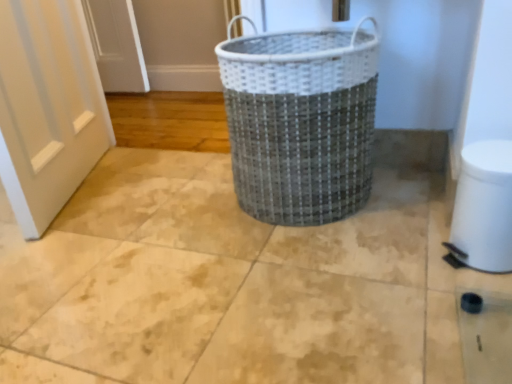
Question: Does metallic woven basket at center come in front of white plastic toilet bowl at lower right?

Choices:
 (A) no
 (B) yes

Answer: (A)

Question: Does metallic woven basket at center contain white plastic toilet bowl at lower right?

Choices:
 (A) yes
 (B) no

Answer: (B)

Question: Does metallic woven basket at center have a smaller size compared to white plastic toilet bowl at lower right?

Choices:
 (A) no
 (B) yes

Answer: (A)

Question: From the image's perspective, is metallic woven basket at center located above white plastic toilet bowl at lower right?

Choices:
 (A) yes
 (B) no

Answer: (A)

Question: Is metallic woven basket at center further to the viewer compared to white plastic toilet bowl at lower right?

Choices:
 (A) no
 (B) yes

Answer: (B)

Question: From a real-world perspective, is metallic woven basket at center located higher than white plastic toilet bowl at lower right?

Choices:
 (A) no
 (B) yes

Answer: (B)

Question: Does white plastic toilet bowl at lower right have a greater width compared to metallic woven basket at center?

Choices:
 (A) no
 (B) yes

Answer: (A)

Question: Would you say metallic woven basket at center is part of white plastic toilet bowl at lower right's contents?

Choices:
 (A) no
 (B) yes

Answer: (A)

Question: From the image's perspective, is white plastic toilet bowl at lower right below metallic woven basket at center?

Choices:
 (A) yes
 (B) no

Answer: (A)

Question: Does white plastic toilet bowl at lower right have a smaller size compared to metallic woven basket at center?

Choices:
 (A) yes
 (B) no

Answer: (A)

Question: Is white plastic toilet bowl at lower right closer to camera compared to metallic woven basket at center?

Choices:
 (A) yes
 (B) no

Answer: (A)

Question: Considering the relative sizes of white plastic toilet bowl at lower right and metallic woven basket at center in the image provided, is white plastic toilet bowl at lower right shorter than metallic woven basket at center?

Choices:
 (A) no
 (B) yes

Answer: (B)

Question: In terms of size, does white plastic toilet bowl at lower right appear bigger or smaller than metallic woven basket at center?

Choices:
 (A) big
 (B) small

Answer: (B)